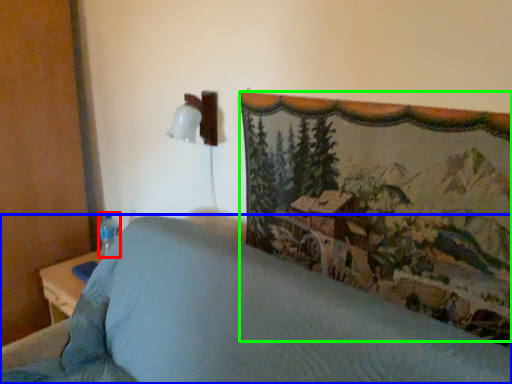
Question: Based on their relative distances, which object is nearer to bottle (highlighted by a red box)? Choose from furniture (highlighted by a blue box) and mountain landscape (highlighted by a green box).

Choices:
 (A) furniture
 (B) mountain landscape

Answer: (A)